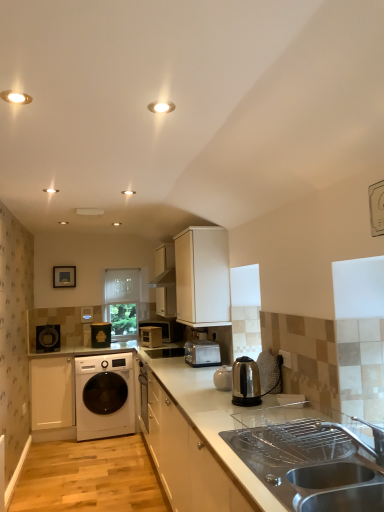
This screenshot has width=384, height=512. I want to click on metallic silver microwave at center, placed as the second appliance when sorted from left to right, so pos(151,336).

Describe the element at coordinates (52, 393) in the screenshot. I see `white matte cabinet at lower left, the first cabinetry when ordered from bottom to top` at that location.

The width and height of the screenshot is (384, 512). Describe the element at coordinates (122, 302) in the screenshot. I see `clear glass window screen at center` at that location.

The height and width of the screenshot is (512, 384). What do you see at coordinates (161, 106) in the screenshot?
I see `matte white recessed light at upper center, which is counted as the 1th lighting, starting from the back` at bounding box center [161, 106].

What is the approximate height of matte white recessed light at upper center, the 2th lighting positioned from the front?

0.40 inches.

Describe the element at coordinates (202, 276) in the screenshot. I see `white matte cabinet at upper center, which is the 1th cabinetry in front-to-back order` at that location.

Identify the location of metallic silver microwave at center, placed as the second appliance when sorted from left to right. Image resolution: width=384 pixels, height=512 pixels. (151, 336).

Would you consider metallic silver microwave at center, placed as the second appliance when sorted from left to right, to be distant from stainless steel kettle at center, which is counted as the 3th home appliance, starting from the back?

Yes, metallic silver microwave at center, placed as the second appliance when sorted from left to right, and stainless steel kettle at center, which is counted as the 3th home appliance, starting from the back, are quite far apart.

Which point is more forward, (155, 344) or (233, 397)?

Point (233, 397)

Consider the image. From the image's perspective, is metallic silver microwave at center, placed as the second appliance when sorted from left to right, located above or below stainless steel kettle at center, positioned as the 1th home appliance in front-to-back order?

Based on their image positions, metallic silver microwave at center, placed as the second appliance when sorted from left to right, is located beneath stainless steel kettle at center, positioned as the 1th home appliance in front-to-back order.

From the metallic silver microwave at center, placed as the second appliance when sorted from left to right, count 2nd home appliance to the right and point to it. Please provide its 2D coordinates.

[(245, 382)]

Is matte black speaker at left, which is the third home appliance in right-to-left order, outside of metallic silver microwave at center, placed as the second appliance when sorted from left to right?

Yes, matte black speaker at left, which is the third home appliance in right-to-left order, is outside of metallic silver microwave at center, placed as the second appliance when sorted from left to right.

From the image's perspective, who appears lower, matte black speaker at left, positioned as the 3th home appliance in front-to-back order, or metallic silver microwave at center, placed as the second appliance when sorted from left to right?

metallic silver microwave at center, placed as the second appliance when sorted from left to right, is shown below in the image.

From a real-world perspective, between matte black speaker at left, which is the third home appliance in right-to-left order, and metallic silver microwave at center, placed as the second appliance when sorted from left to right, who is vertically lower?

In real-world perspective, metallic silver microwave at center, placed as the second appliance when sorted from left to right, is lower.

Which object is wider, white glossy countertop at center or metallic silver toaster at center?

With larger width is white glossy countertop at center.

From the image's perspective, is white glossy countertop at center located beneath metallic silver toaster at center?

Yes, from the image's perspective, white glossy countertop at center is beneath metallic silver toaster at center.

Is white glossy countertop at center positioned with its back to metallic silver toaster at center?

No, white glossy countertop at center is not facing away from metallic silver toaster at center.

Measure the distance from white matte cabinet at upper center, the 2th cabinetry positioned from the left, to stainless steel kettle at center, positioned as the 1th home appliance in front-to-back order.

A distance of 34.06 inches exists between white matte cabinet at upper center, the 2th cabinetry positioned from the left, and stainless steel kettle at center, positioned as the 1th home appliance in front-to-back order.

From a real-world perspective, which object stands above the other?

white matte cabinet at upper center, acting as the first cabinetry starting from the top.

How many degrees apart are the facing directions of white matte cabinet at upper center, acting as the first cabinetry starting from the top, and stainless steel kettle at center, marked as the first home appliance in a right-to-left arrangement?

The angular difference between white matte cabinet at upper center, acting as the first cabinetry starting from the top, and stainless steel kettle at center, marked as the first home appliance in a right-to-left arrangement, is 1.47 degrees.

Considering the positions of objects white matte cabinet at upper center, the 2th cabinetry positioned from the left, and stainless steel kettle at center, which is counted as the 3th home appliance, starting from the back, in the image provided, who is behind, white matte cabinet at upper center, the 2th cabinetry positioned from the left, or stainless steel kettle at center, which is counted as the 3th home appliance, starting from the back,?

white matte cabinet at upper center, the 2th cabinetry positioned from the left, is further from the camera.

Based on their positions, is clear glass window screen at center located to the left or right of white glossy washing machine at lower left?

Based on their positions, clear glass window screen at center is located to the right of white glossy washing machine at lower left.

Is clear glass window screen at center outside of white glossy washing machine at lower left?

Yes.

From the image's perspective, which one is positioned lower, clear glass window screen at center or white glossy washing machine at lower left?

From the image's view, white glossy washing machine at lower left is below.

Locate an element on the screen. The height and width of the screenshot is (512, 384). lighting that is the 1st object located above the matte black speaker at left, positioned as the 3th home appliance in front-to-back order (from the image's perspective) is located at coordinates (15, 97).

Is white glossy light fixture at upper left, which appears as the second lighting when viewed from the back, placed right next to matte black speaker at left, which is the first home appliance in back-to-front order?

No, white glossy light fixture at upper left, which appears as the second lighting when viewed from the back, is not making contact with matte black speaker at left, which is the first home appliance in back-to-front order.

Which of these two, white glossy light fixture at upper left, the 1th lighting in the left-to-right sequence, or matte black speaker at left, which is the third home appliance in right-to-left order, is wider?

Wider between the two is matte black speaker at left, which is the third home appliance in right-to-left order.

Is metallic silver toaster at center, marked as the 1th appliance in a left-to-right arrangement, taller or shorter than white matte cabinet at upper center, acting as the first cabinetry starting from the top?

metallic silver toaster at center, marked as the 1th appliance in a left-to-right arrangement, is shorter than white matte cabinet at upper center, acting as the first cabinetry starting from the top.

Is metallic silver toaster at center, the 2th appliance positioned from the right, at the right side of white matte cabinet at upper center, acting as the first cabinetry starting from the top?

Incorrect, metallic silver toaster at center, the 2th appliance positioned from the right, is not on the right side of white matte cabinet at upper center, acting as the first cabinetry starting from the top.

Does metallic silver toaster at center, marked as the 1th appliance in a left-to-right arrangement, come in front of white matte cabinet at upper center, acting as the first cabinetry starting from the top?

That is False.

This screenshot has width=384, height=512. Find the location of `appliance below the stainless steel kettle at center, marked as the first home appliance in a right-to-left arrangement (from a real-world perspective)`. appliance below the stainless steel kettle at center, marked as the first home appliance in a right-to-left arrangement (from a real-world perspective) is located at coordinates (151, 336).

You are a GUI agent. You are given a task and a screenshot of the screen. Output one action in this format:
    pyautogui.click(x=<x>, y=<y>)
    Task: Click on the 2nd home appliance located above the metallic silver microwave at center, placed as the second appliance when sorted from left to right (from a real-world perspective)
    The width and height of the screenshot is (384, 512).
    Given the screenshot: What is the action you would take?
    pyautogui.click(x=47, y=338)

Looking at the image, which one is located closer to stainless steel sink at lower right, matte black speaker at left, which is the first home appliance in back-to-front order, or clear glass window screen at center?

clear glass window screen at center.

Looking at the image, which one is located further to stainless steel sink at lower right, white matte cabinet at upper center, which is the 1th cabinetry in front-to-back order, or white matte cabinet at lower left, which is the second cabinetry in right-to-left order?

Result: white matte cabinet at lower left, which is the second cabinetry in right-to-left order, is positioned further to the anchor stainless steel sink at lower right.

When comparing their distances from metallic silver toaster at center, does matte white recessed light at upper center, marked as the first lighting in a right-to-left arrangement, or stainless steel kettle at center, which is counted as the 3th home appliance, starting from the back, seem further?

matte white recessed light at upper center, marked as the first lighting in a right-to-left arrangement, lies further to metallic silver toaster at center than the other object.

Consider the image. From the image, which object appears to be farther from satin silver toaster at center, the 2th home appliance in the front-to-back sequence, metallic silver microwave at center, placed as the second appliance when sorted from left to right, or white glossy countertop at center?

The object further to satin silver toaster at center, the 2th home appliance in the front-to-back sequence, is metallic silver microwave at center, placed as the second appliance when sorted from left to right.

Looking at the image, which one is located further to satin silver toaster at center, which is the second home appliance in right-to-left order, clear glass window screen at center or white matte cabinet at upper center, which ranks as the first cabinetry in right-to-left order?

clear glass window screen at center.

When comparing their distances from metallic silver toaster at center, does white glossy washing machine at lower left or matte black speaker at left, which is the third home appliance in right-to-left order, seem further?

matte black speaker at left, which is the third home appliance in right-to-left order, lies further to metallic silver toaster at center than the other object.

Looking at the image, which one is located closer to white glossy washing machine at lower left, white glossy countertop at center or matte white recessed light at upper center, the 2th lighting positioned from the front?

Among the two, white glossy countertop at center is located nearer to white glossy washing machine at lower left.

Based on the photo, which object lies nearer to the anchor point matte white recessed light at upper center, the 2th lighting positioned from the front, stainless steel sink at lower right or metallic silver toaster at center?

The object closer to matte white recessed light at upper center, the 2th lighting positioned from the front, is stainless steel sink at lower right.

You are a GUI agent. You are given a task and a screenshot of the screen. Output one action in this format:
    pyautogui.click(x=<x>, y=<y>)
    Task: Click on the appliance between metallic silver microwave at center, placed as the second appliance when sorted from left to right, and clear glass window screen at center in the front-back direction
    The width and height of the screenshot is (384, 512).
    Given the screenshot: What is the action you would take?
    pyautogui.click(x=100, y=335)

Where is `home appliance between white matte cabinet at lower left, which is the second cabinetry in top-to-bottom order, and clear glass window screen at center from front to back`? The image size is (384, 512). home appliance between white matte cabinet at lower left, which is the second cabinetry in top-to-bottom order, and clear glass window screen at center from front to back is located at coordinates (47, 338).

In order to click on washing machine between satin silver toaster at center, which is the second home appliance in right-to-left order, and metallic silver toaster at center, along the z-axis in this screenshot , I will do `click(104, 396)`.

This screenshot has height=512, width=384. Identify the location of lighting between matte white recessed light at upper center, the 2th lighting positioned from the front, and white glossy countertop at center from top to bottom. (15, 97).